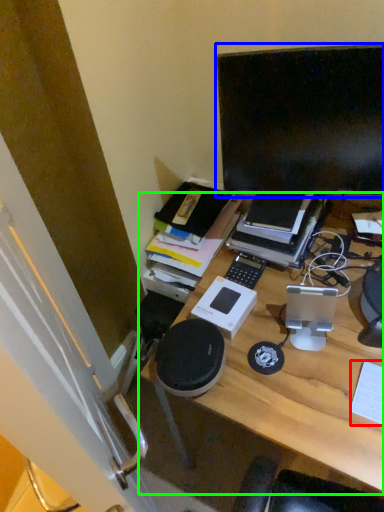
Question: Estimate the real-world distances between objects in this image. Which object is farther from computer keyboard (highlighted by a red box), computer monitor (highlighted by a blue box) or desk (highlighted by a green box)?

Choices:
 (A) computer monitor
 (B) desk

Answer: (A)